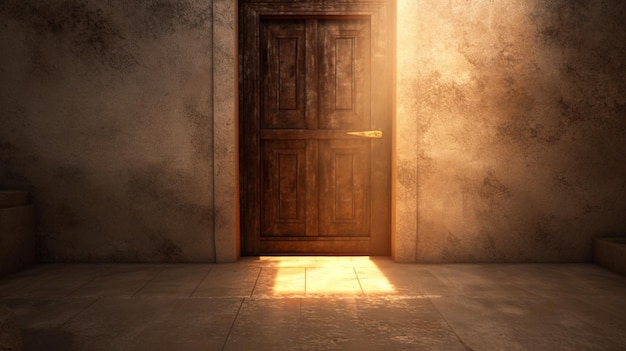
Where is `wooden door`? wooden door is located at coordinates (327, 104).